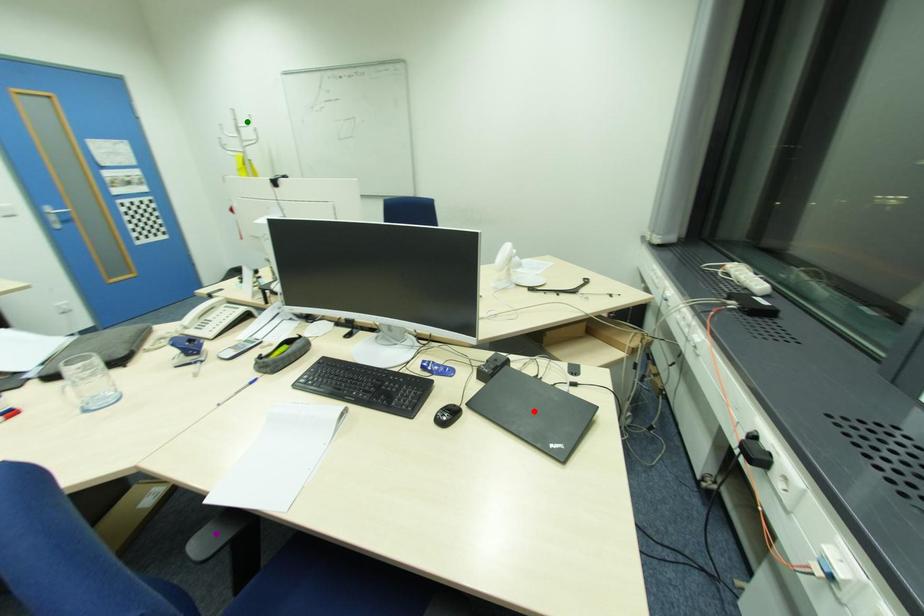
Order these from nearest to farthest:
- red point
- green point
- purple point

purple point → red point → green point